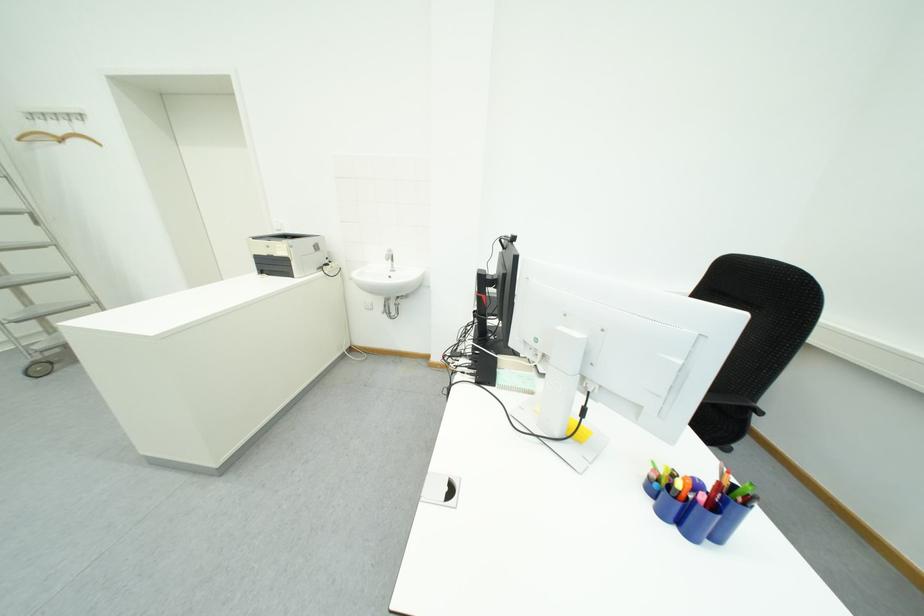
Find the location of a particular element. This screenshot has height=616, width=924. yellow sticky notes is located at coordinates point(578,431).